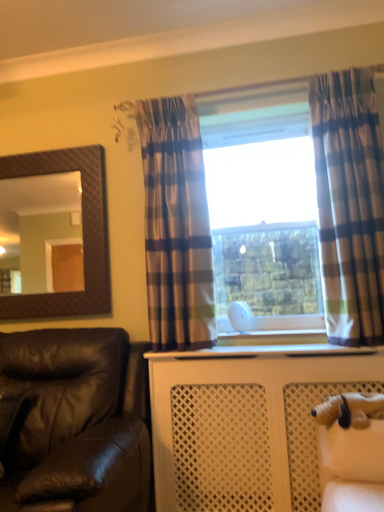
Question: In terms of size, does brown textured mirror at upper left appear bigger or smaller than white plastic window frame at center?

Choices:
 (A) big
 (B) small

Answer: (B)

Question: In the image, is brown textured mirror at upper left on the left side or the right side of white plastic window frame at center?

Choices:
 (A) left
 (B) right

Answer: (A)

Question: Based on their relative distances, which object is nearer to the leather at left?

Choices:
 (A) white plastic window frame at center
 (B) plaid fabric curtain at right, marked as the second curtain in a left-to-right arrangement
 (C) plaid fabric curtain at center, marked as the second curtain in a right-to-left arrangement
 (D) brown textured mirror at upper left
 (E) white plush dog at lower right

Answer: (C)

Question: Estimate the real-world distances between objects in this image. Which object is closer to the plaid fabric curtain at right, marked as the second curtain in a left-to-right arrangement?

Choices:
 (A) white plush dog at lower right
 (B) white plastic window frame at center
 (C) plaid fabric curtain at center, marked as the second curtain in a right-to-left arrangement
 (D) brown textured mirror at upper left
 (E) leather at left

Answer: (B)